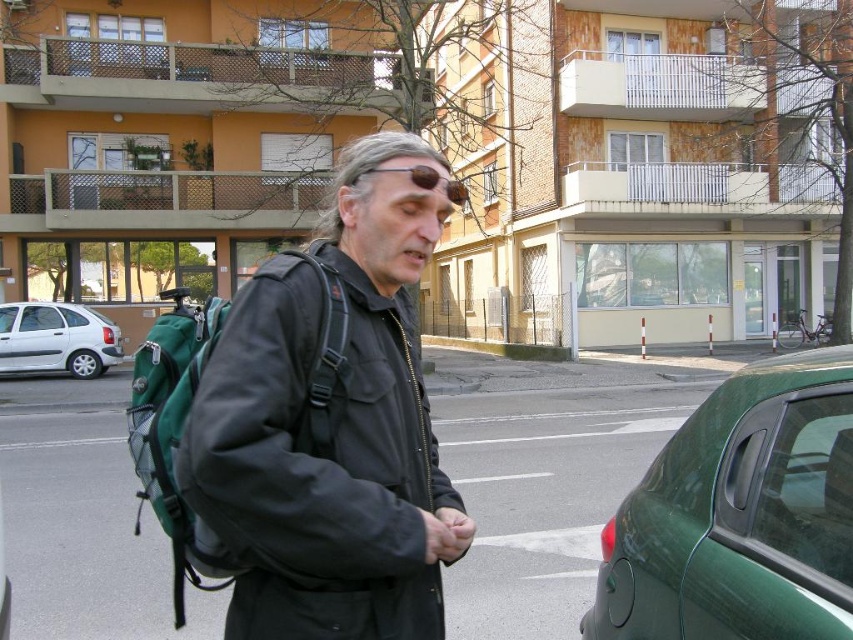
Question: Does green fabric backpack at center have a larger size compared to white matte car at left?

Choices:
 (A) yes
 (B) no

Answer: (A)

Question: Does green fabric backpack at center have a lesser width compared to green fabric backpack at left?

Choices:
 (A) yes
 (B) no

Answer: (B)

Question: Which point appears closest to the camera in this image?

Choices:
 (A) (320, 444)
 (B) (350, 346)

Answer: (A)

Question: Among these points, which one is nearest to the camera?

Choices:
 (A) (730, 483)
 (B) (149, 420)
 (C) (212, 298)
 (D) (77, 364)

Answer: (A)

Question: Can you confirm if matte black backpack at center is positioned to the right of white matte car at left?

Choices:
 (A) yes
 (B) no

Answer: (A)

Question: Which of the following is the farthest from the observer?

Choices:
 (A) green matte car at lower right
 (B) white matte car at left

Answer: (B)